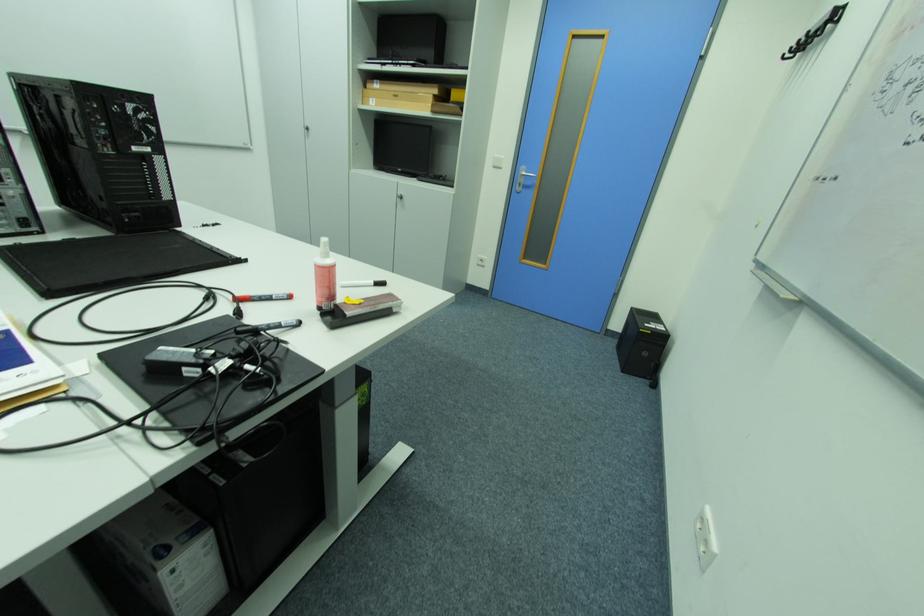
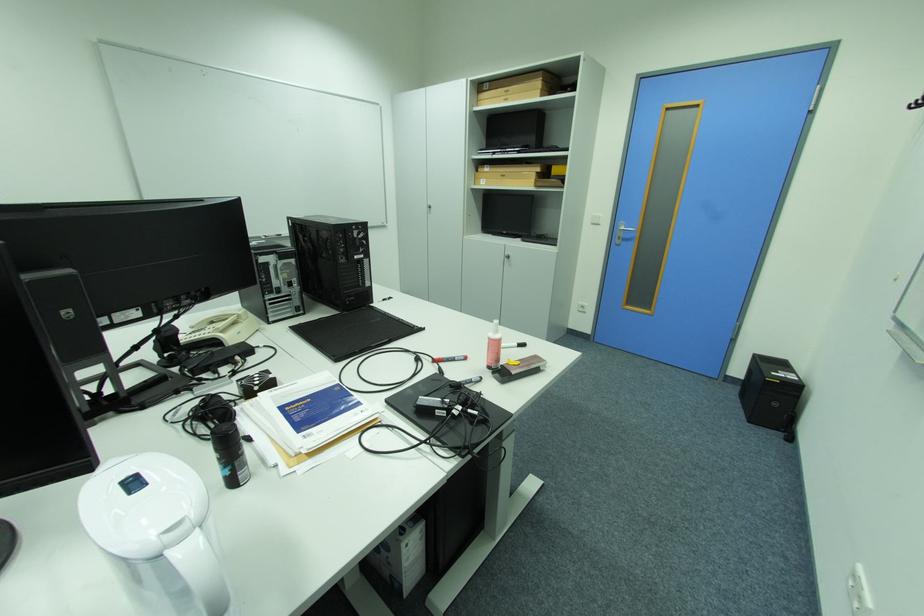
In the second image, find the point that corresponds to (246,301) in the first image.

(443, 362)